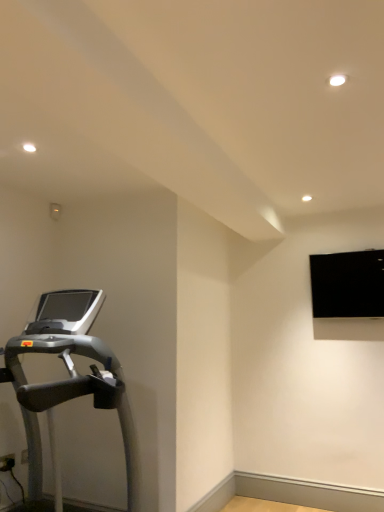
Question: In terms of height, does silver metallic treadmill at left look taller or shorter compared to black matte projection screen at upper right?

Choices:
 (A) tall
 (B) short

Answer: (A)

Question: Is silver metallic treadmill at left in front of or behind black matte projection screen at upper right in the image?

Choices:
 (A) front
 (B) behind

Answer: (A)

Question: From the image's perspective, relative to black matte projection screen at upper right, is silver metallic treadmill at left above or below?

Choices:
 (A) below
 (B) above

Answer: (A)

Question: In terms of size, does black matte projection screen at upper right appear bigger or smaller than silver metallic treadmill at left?

Choices:
 (A) small
 (B) big

Answer: (A)

Question: From the image's perspective, is black matte projection screen at upper right above or below silver metallic treadmill at left?

Choices:
 (A) above
 (B) below

Answer: (A)

Question: Relative to silver metallic treadmill at left, is black matte projection screen at upper right in front or behind?

Choices:
 (A) front
 (B) behind

Answer: (B)

Question: Would you say black matte projection screen at upper right is to the left or to the right of silver metallic treadmill at left in the picture?

Choices:
 (A) right
 (B) left

Answer: (A)